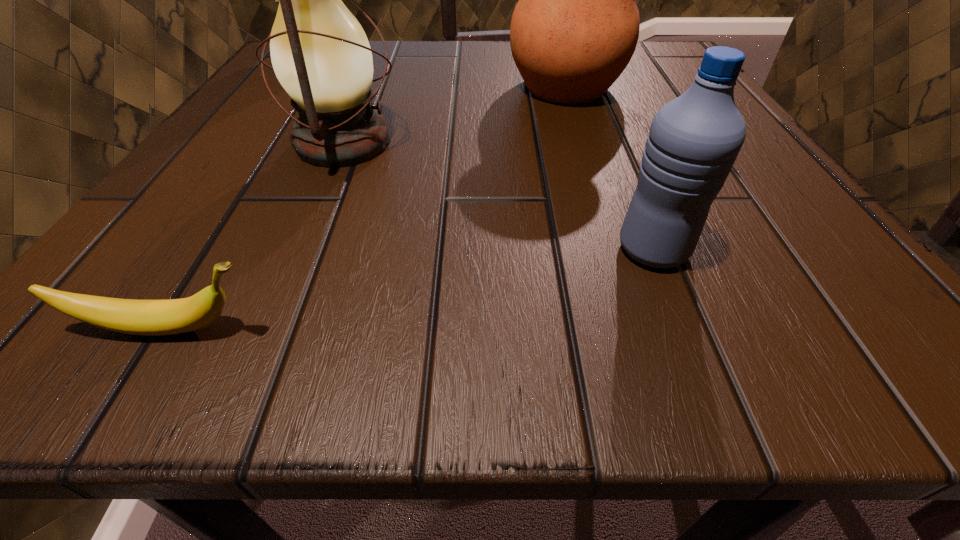
Locate an element on the screen. The width and height of the screenshot is (960, 540). unoccupied area between the wine bottle and the pottery is located at coordinates (444, 70).

Locate an element on the screen. The height and width of the screenshot is (540, 960). vacant region between the oil lamp and the second nearest object is located at coordinates (499, 196).

The height and width of the screenshot is (540, 960). Find the location of `blank region between the fourth shortest object and the pottery`. blank region between the fourth shortest object and the pottery is located at coordinates (455, 115).

At what (x,y) coordinates should I click in order to perform the action: click on free space between the water bottle and the pottery. Please return your answer as a coordinate pair (x, y). Looking at the image, I should click on pyautogui.click(x=610, y=168).

Locate an element on the screen. The image size is (960, 540). unoccupied area between the tallest object and the pottery is located at coordinates (444, 70).

Locate an element on the screen. free space between the oil lamp and the fourth farthest object is located at coordinates (499, 196).

Where is `free space between the water bottle and the nearest object`? free space between the water bottle and the nearest object is located at coordinates (411, 289).

In order to click on object that is the fourth closest to the banana in this screenshot , I will do `click(343, 0)`.

Select which object appears as the second closest to the oil lamp. Please provide its 2D coordinates. Your answer should be formatted as a tuple, i.e. [(x, y)], where the tuple contains the x and y coordinates of a point satisfying the conditions above.

[(343, 0)]

You are a GUI agent. You are given a task and a screenshot of the screen. Output one action in this format:
    pyautogui.click(x=<x>, y=<y>)
    Task: Click on the vacant area in the image that satisfies the following two spatial constraints: 1. on the front-facing side of the tallest object; 2. on the right side of the second tallest object
    The height and width of the screenshot is (540, 960).
    Given the screenshot: What is the action you would take?
    pyautogui.click(x=262, y=143)